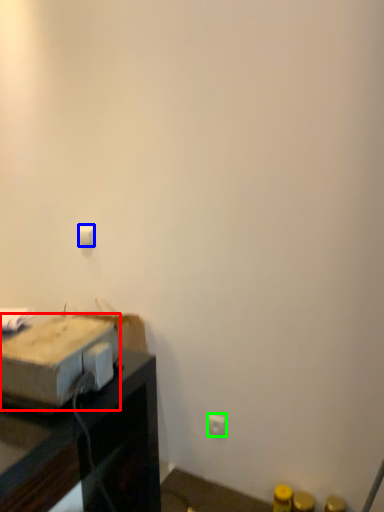
Question: Estimate the real-world distances between objects in this image. Which object is farther from cardboard box (highlighted by a red box), light switch (highlighted by a blue box) or electric outlet (highlighted by a green box)?

Choices:
 (A) light switch
 (B) electric outlet

Answer: (B)